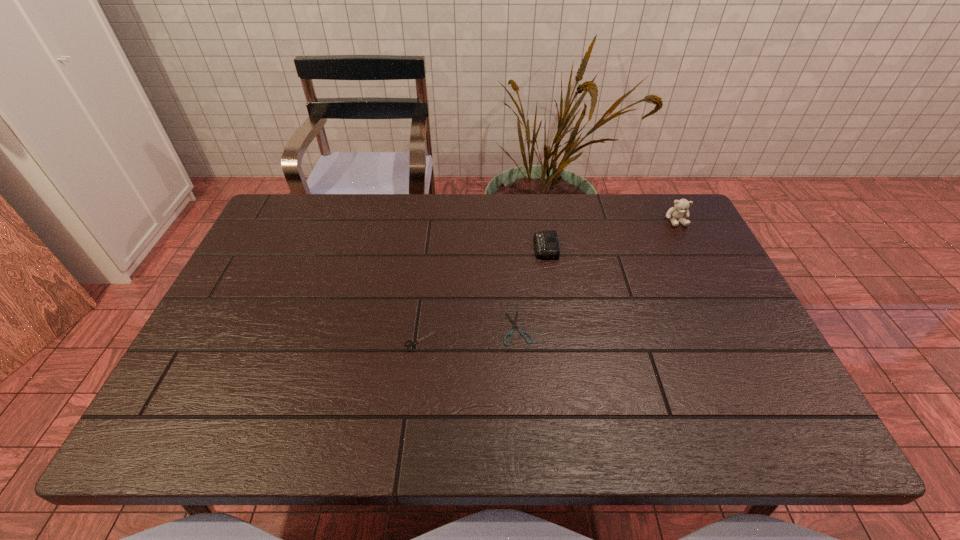
In the image, there is a desktop. Where is `blank space at the right edge`? The height and width of the screenshot is (540, 960). blank space at the right edge is located at coordinates (718, 341).

This screenshot has height=540, width=960. In the image, there is a desktop. Identify the location of free region at the far left corner. (320, 205).

Locate an element on the screen. vacant space at the far right corner is located at coordinates (660, 213).

Identify the location of vacant area that lies between the rightmost object and the third tallest object. This screenshot has width=960, height=540. (548, 280).

Where is `free spot between the shortest object and the left shears`? The width and height of the screenshot is (960, 540). free spot between the shortest object and the left shears is located at coordinates (468, 334).

What are the coordinates of `empty space between the second shortest object and the alarm clock` in the screenshot? It's located at (483, 294).

At what (x,y) coordinates should I click in order to perform the action: click on free space between the second tallest object and the rightmost object. Please return your answer as a coordinate pair (x, y). Looking at the image, I should click on (611, 234).

At what (x,y) coordinates should I click in order to perform the action: click on vacant space in between the third shortest object and the third tallest object. Please return your answer as a coordinate pair (x, y). This screenshot has height=540, width=960. Looking at the image, I should click on (483, 294).

The height and width of the screenshot is (540, 960). Find the location of `free space between the shorter shears and the third object from left to right`. free space between the shorter shears and the third object from left to right is located at coordinates (532, 288).

You are a GUI agent. You are given a task and a screenshot of the screen. Output one action in this format:
    pyautogui.click(x=<x>, y=<y>)
    Task: Click on the vacant area that lies between the farthest object and the shorter shears
    The image size is (960, 540).
    Given the screenshot: What is the action you would take?
    pyautogui.click(x=597, y=274)